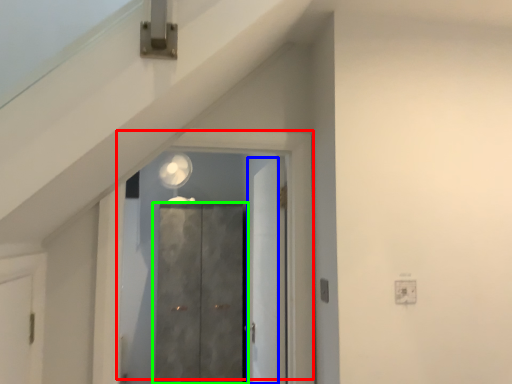
Question: Which object is positioned closest to door (highlighted by a red box)? Select from door (highlighted by a blue box) and door (highlighted by a green box).

Choices:
 (A) door
 (B) door

Answer: (A)